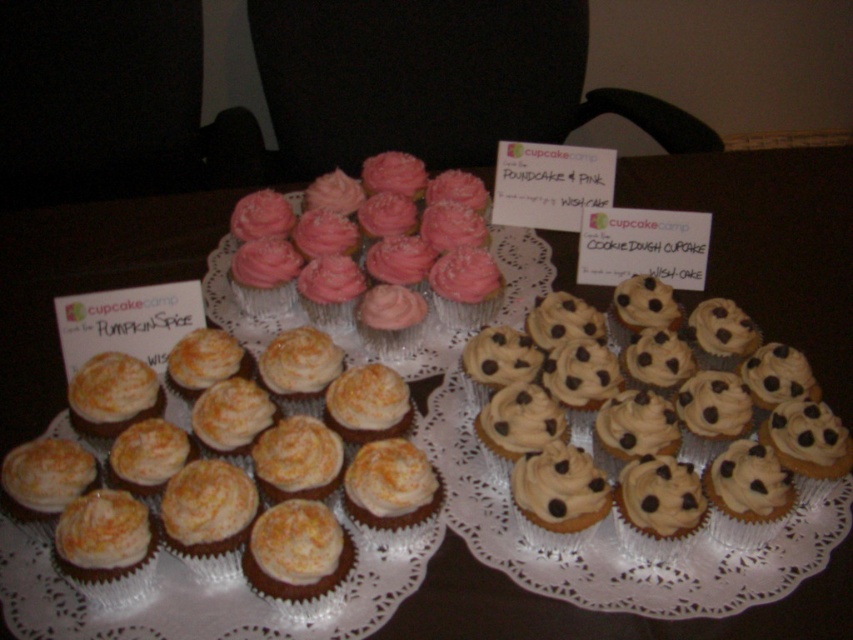
Can you confirm if chocolate frosted cupcake at center is positioned above chocolate-coated cookie dough cupcake at center-right?

No, chocolate frosted cupcake at center is not above chocolate-coated cookie dough cupcake at center-right.

Which is more to the right, chocolate frosted cupcake at center or chocolate-coated cookie dough cupcake at center-right?

chocolate-coated cookie dough cupcake at center-right is more to the right.

What do you see at coordinates (296, 552) in the screenshot?
I see `chocolate frosted cupcake at center` at bounding box center [296, 552].

You are a GUI agent. You are given a task and a screenshot of the screen. Output one action in this format:
    pyautogui.click(x=<x>, y=<y>)
    Task: Click on the chocolate frosted cupcake at center
    This screenshot has width=853, height=640.
    Given the screenshot: What is the action you would take?
    pyautogui.click(x=296, y=552)

Is matte orange frosting cupcake at lower left below chocolate chip cookie dough cupcake at center right?

Yes, matte orange frosting cupcake at lower left is below chocolate chip cookie dough cupcake at center right.

Does matte orange frosting cupcake at lower left have a greater width compared to chocolate chip cookie dough cupcake at center right?

Yes, matte orange frosting cupcake at lower left is wider than chocolate chip cookie dough cupcake at center right.

Who is more forward, (x=61, y=557) or (x=773, y=518)?

Point (x=61, y=557) is more forward.

The height and width of the screenshot is (640, 853). In order to click on matte orange frosting cupcake at lower left in this screenshot , I will do `click(106, 547)`.

Consider the image. Can you confirm if chocolate chip cookie dough cupcake at center is positioned below pink frosted cupcake at center?

Yes, chocolate chip cookie dough cupcake at center is below pink frosted cupcake at center.

Does chocolate chip cookie dough cupcake at center have a larger size compared to pink frosted cupcake at center?

Actually, chocolate chip cookie dough cupcake at center might be smaller than pink frosted cupcake at center.

Measure the distance between chocolate chip cookie dough cupcake at center and camera.

A distance of 25.67 inches exists between chocolate chip cookie dough cupcake at center and camera.

Locate an element on the screen. chocolate chip cookie dough cupcake at center is located at coordinates (654, 422).